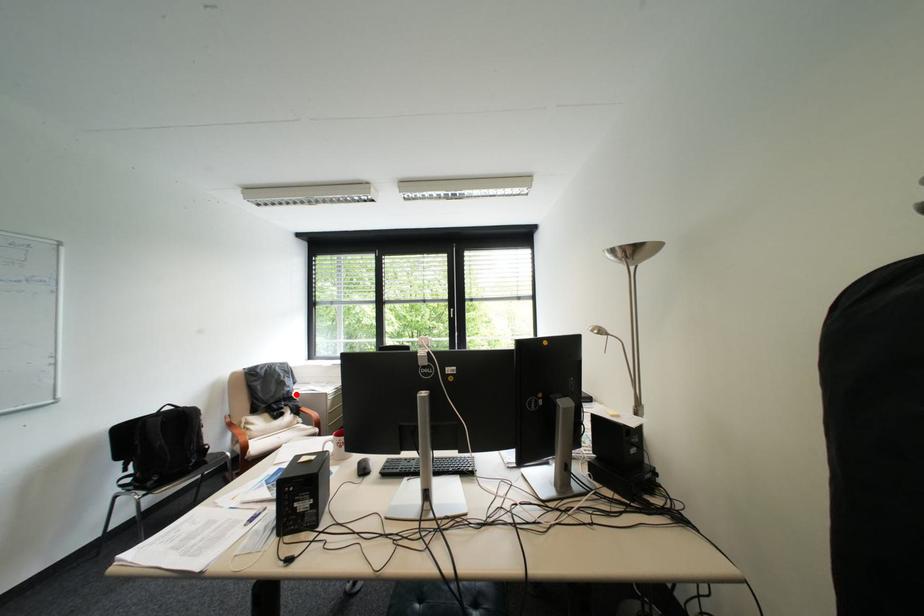
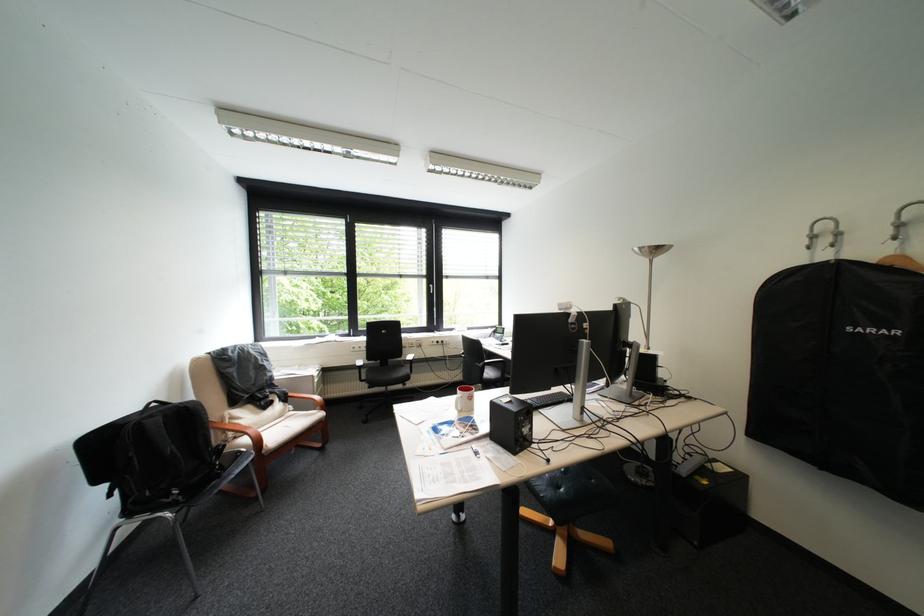
Where in the second image is the point corresponding to the highlighted location from the first image?

(280, 381)